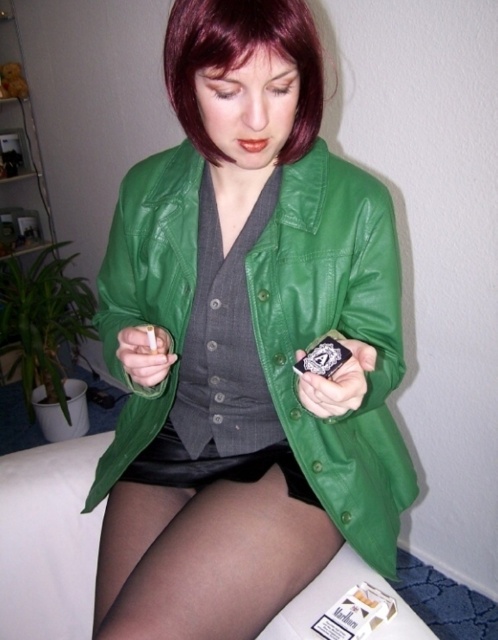
Question: Is green leather jacket at center smaller than dark red silky hair at upper center?

Choices:
 (A) yes
 (B) no

Answer: (B)

Question: Based on their relative distances, which object is nearer to the black sheer tights at lower center?

Choices:
 (A) green leather jacket at center
 (B) dark red silky hair at upper center

Answer: (A)

Question: Observing the image, what is the correct spatial positioning of black sheer tights at lower center in reference to dark red silky hair at upper center?

Choices:
 (A) right
 (B) left

Answer: (B)

Question: Which point is closer to the camera?

Choices:
 (A) (234, 547)
 (B) (248, 8)
 (C) (224, 604)

Answer: (B)

Question: Among these objects, which one is nearest to the camera?

Choices:
 (A) green leather jacket at center
 (B) dark red silky hair at upper center

Answer: (A)

Question: Is green leather jacket at center wider than dark red silky hair at upper center?

Choices:
 (A) yes
 (B) no

Answer: (A)